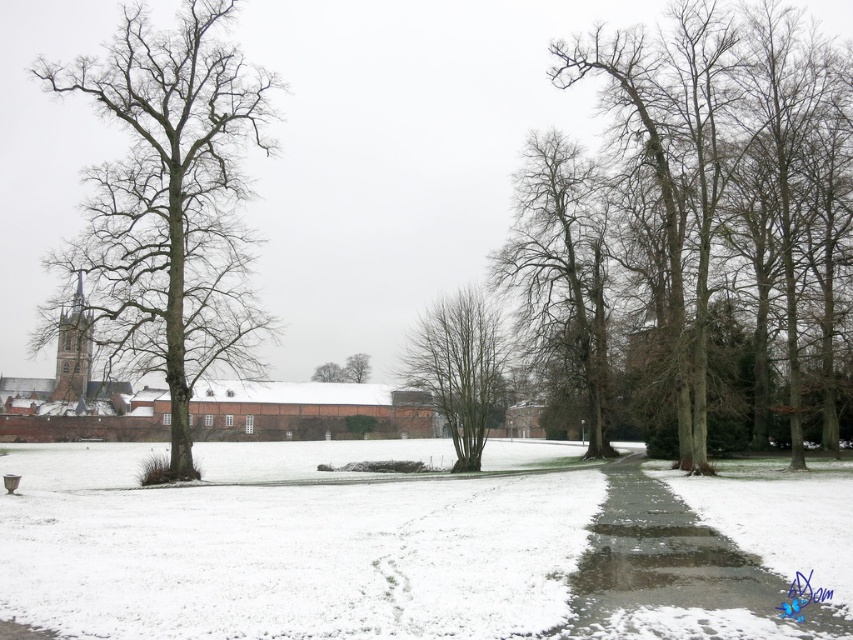
You are a delivery robot with a width of 0.8 meters. You need to navigate through the glossy concrete path at lower right. Can you pass through the narrowest part of the path without hitting the bare wood tree at left?

The bare wood tree at left might be wider than the glossy concrete path at lower right, so there is a possibility that the path is narrower than the tree. Since the robot is 0.8 meters wide, it might not fit if the path is narrower than 0.8 meters. However, without exact measurements, it is uncertain. Proceed with caution.

You are standing on the paved pathway and want to take a photo of the white powdery snow at center and the bare branches at center. Which object will appear larger in your photo?

The white powdery snow at center will appear larger in the photo because it is closer to the viewer than the bare branches at center.

You are a delivery person carrying a heavy package and need to walk along the path. The bare wood tree at left is blocking your view of the path ahead. Can you see the glossy concrete path at lower right beyond the tree?

The glossy concrete path at lower right is behind the bare wood tree at left, so it is hidden from view by the tree. You cannot see the glossy concrete path at lower right beyond the tree.